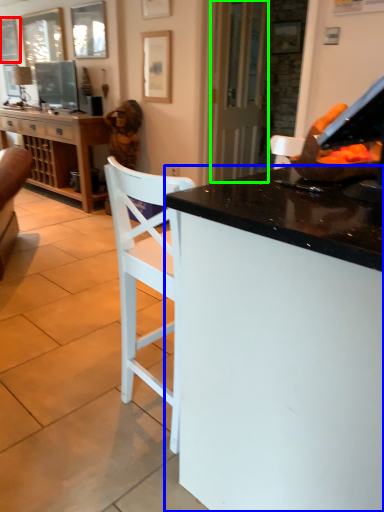
Question: Which object is positioned farthest from picture frame (highlighted by a red box)? Select from desk (highlighted by a blue box) and glass door (highlighted by a green box).

Choices:
 (A) desk
 (B) glass door

Answer: (A)